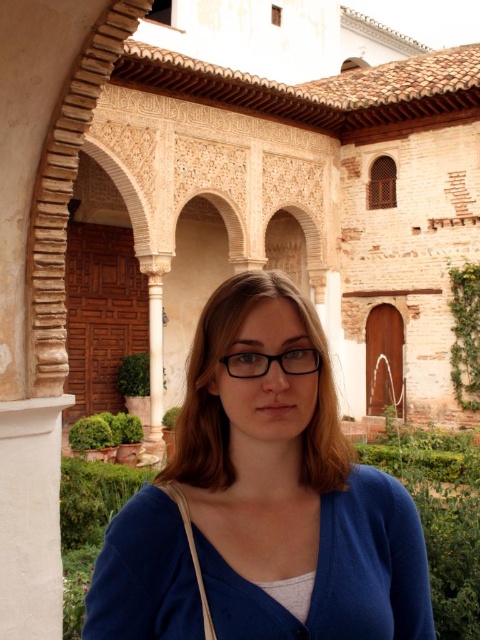
Is blue knitted sweater at center taller than transparent plastic glasses at center?

Indeed, blue knitted sweater at center has a greater height compared to transparent plastic glasses at center.

How far apart are blue knitted sweater at center and transparent plastic glasses at center?

4.84 meters

At what (x,y) coordinates should I click in order to perform the action: click on blue knitted sweater at center. Please return your answer as a coordinate pair (x, y). Looking at the image, I should click on (338, 572).

Where is `blue knitted sweater at center`? The image size is (480, 640). blue knitted sweater at center is located at coordinates (338, 572).

Who is lower down, blue fabric at center or blue knitted sweater at center?

blue knitted sweater at center

The height and width of the screenshot is (640, 480). I want to click on blue fabric at center, so click(263, 502).

Locate an element on the screen. Image resolution: width=480 pixels, height=640 pixels. blue fabric at center is located at coordinates (263, 502).

Is point (238, 396) positioned in front of point (240, 376)?

No, it is behind (240, 376).

Between point (324, 531) and point (235, 374), which one is positioned in front?

Point (324, 531)

The image size is (480, 640). What are the coordinates of `blue fabric at center` in the screenshot? It's located at (263, 502).